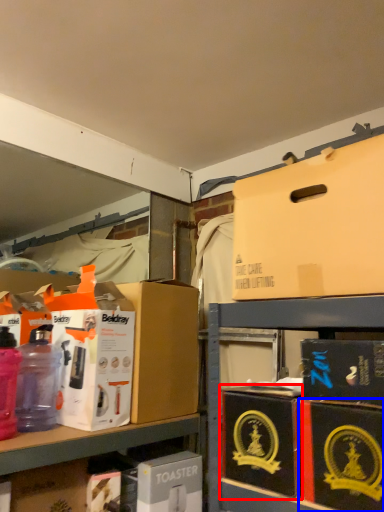
Question: Which of the following is the closest to the observer, box (highlighted by a red box) or box (highlighted by a blue box)?

Choices:
 (A) box
 (B) box

Answer: (B)